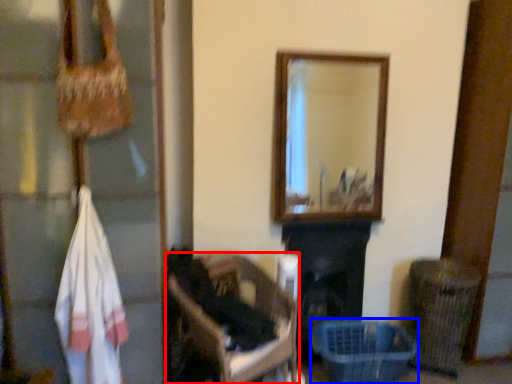
Question: Which point is closer to the camera, furniture (highlighted by a red box) or basket (highlighted by a blue box)?

Choices:
 (A) furniture
 (B) basket

Answer: (A)